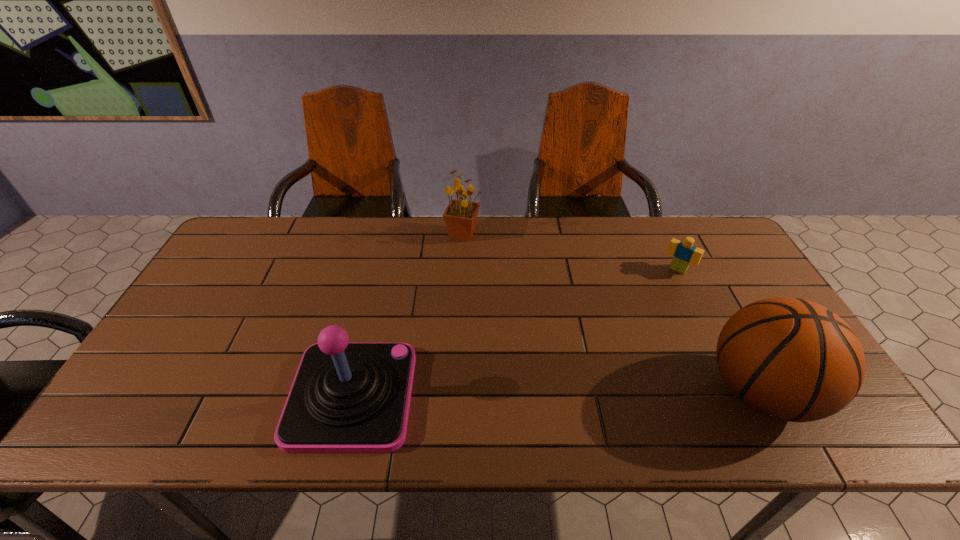
Identify the location of vacant area that lies between the basketball and the second object from left to right. (612, 312).

This screenshot has width=960, height=540. What are the coordinates of `vacant point located between the second farthest object and the basketball` in the screenshot? It's located at (719, 330).

Where is `free area in between the leftmost object and the basketball`? The width and height of the screenshot is (960, 540). free area in between the leftmost object and the basketball is located at coordinates (557, 394).

Locate an element on the screen. This screenshot has height=540, width=960. empty space that is in between the leftmost object and the basketball is located at coordinates (557, 394).

Locate an element on the screen. free space between the joystick and the farthest object is located at coordinates (408, 315).

The image size is (960, 540). Identify the location of free space that is in between the third nearest object and the basketball. (719, 330).

Image resolution: width=960 pixels, height=540 pixels. In order to click on vacant area that lies between the basketball and the joystick in this screenshot , I will do `click(557, 394)`.

Locate an element on the screen. object that stands as the second closest to the third nearest object is located at coordinates (460, 217).

Choose which object is the second nearest neighbor to the Lego. Please provide its 2D coordinates. Your answer should be formatted as a tuple, i.e. [(x, y)], where the tuple contains the x and y coordinates of a point satisfying the conditions above.

[(460, 217)]

Locate an element on the screen. Image resolution: width=960 pixels, height=540 pixels. vacant point that satisfies the following two spatial constraints: 1. on the front side of the basketball; 2. on the left side of the second object from left to right is located at coordinates (457, 391).